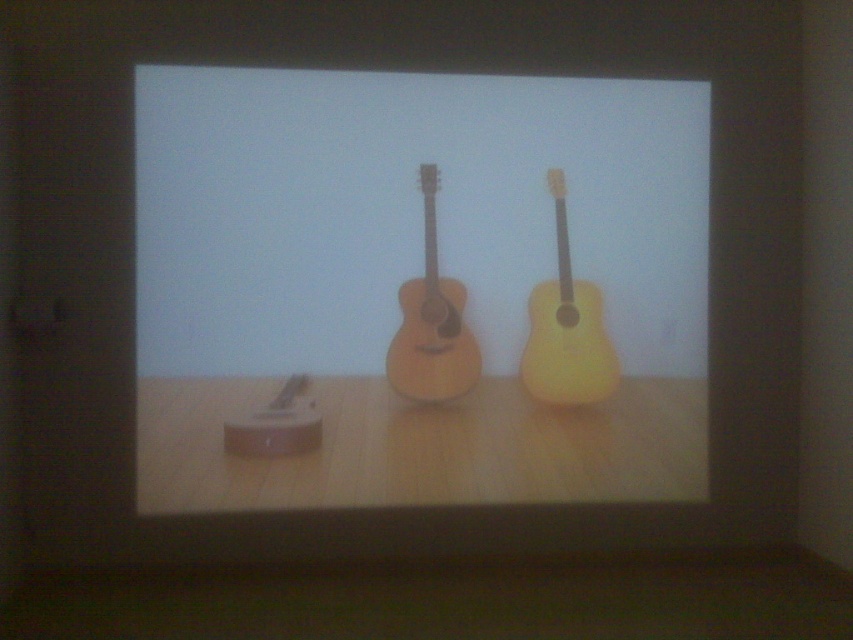
Is yellow matte guitar at right smaller than natural wood acoustic guitar at center?

Actually, yellow matte guitar at right might be larger than natural wood acoustic guitar at center.

Is point (535, 356) positioned in front of point (422, 330)?

No, it is not.

Find the location of a particular element. Image resolution: width=853 pixels, height=640 pixels. yellow matte guitar at right is located at coordinates (566, 328).